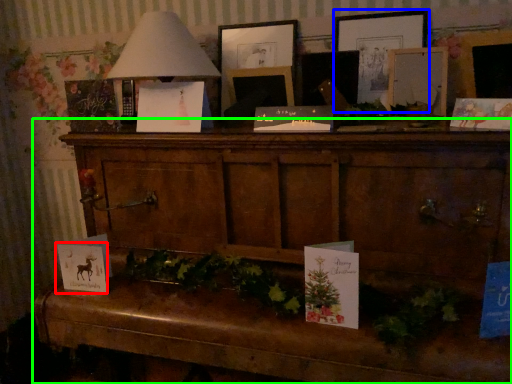
Question: Which is farther away from christmas card (highlighted by a red box)? picture frame (highlighted by a blue box) or furniture (highlighted by a green box)?

Choices:
 (A) picture frame
 (B) furniture

Answer: (A)